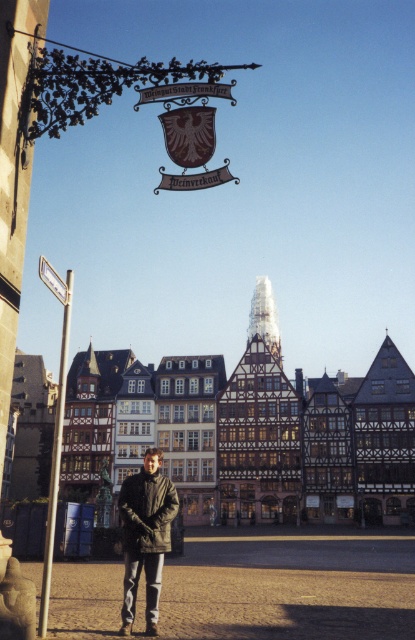
Question: Which of the following is the farthest from the observer?

Choices:
 (A) (53, 499)
 (B) (122, 492)

Answer: (B)

Question: Which object is closer to the camera taking this photo?

Choices:
 (A) dark gray jacket at center
 (B) white plastic street sign at left

Answer: (B)

Question: Estimate the real-world distances between objects in this image. Which object is farther from the white plastic street sign at left?

Choices:
 (A) dark gray jacket at center
 (B) silver metallic pole at left

Answer: (A)

Question: Does dark gray jacket at center appear over silver metallic pole at left?

Choices:
 (A) no
 (B) yes

Answer: (A)

Question: Is dark gray jacket at center closer to camera compared to silver metallic pole at left?

Choices:
 (A) no
 (B) yes

Answer: (A)

Question: Is the position of dark gray jacket at center more distant than that of white plastic street sign at left?

Choices:
 (A) no
 (B) yes

Answer: (B)